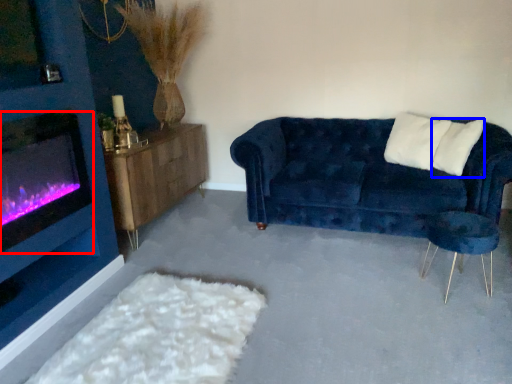
Question: Which object appears farthest to the camera in this image, wood burning stove (highlighted by a red box) or pillow (highlighted by a blue box)?

Choices:
 (A) wood burning stove
 (B) pillow

Answer: (B)